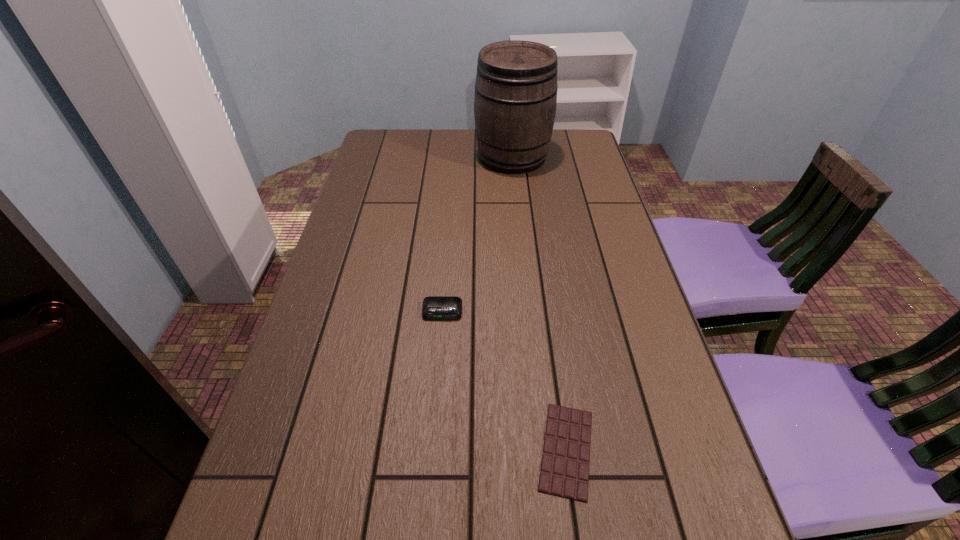
Identify the location of blank space that satisfies the following two spatial constraints: 1. on the display of the alarm clock; 2. on the left side of the chocolate bar. (432, 450).

Identify the location of free spot that satisfies the following two spatial constraints: 1. on the display of the chocolate bar; 2. on the left side of the alarm clock. The image size is (960, 540). (432, 450).